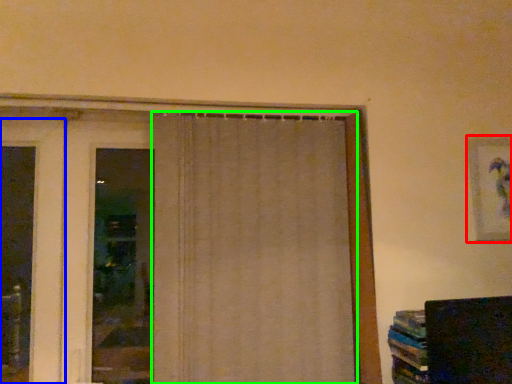
Question: Considering the real-world distances, which object is closest to picture frame (highlighted by a red box)? door (highlighted by a blue box) or curtain (highlighted by a green box).

Choices:
 (A) door
 (B) curtain

Answer: (B)